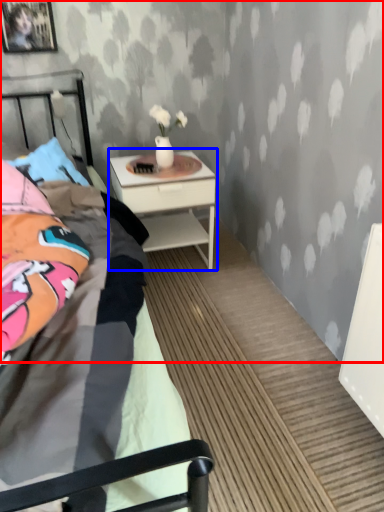
Question: Which object is further to the camera taking this photo, backdrop (highlighted by a red box) or nightstand (highlighted by a blue box)?

Choices:
 (A) backdrop
 (B) nightstand

Answer: (B)